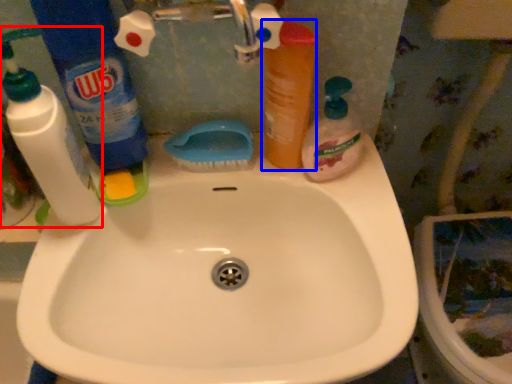
Question: Which point is closer to the camera, cleaning product (highlighted by a red box) or mouthwash (highlighted by a blue box)?

Choices:
 (A) cleaning product
 (B) mouthwash

Answer: (A)